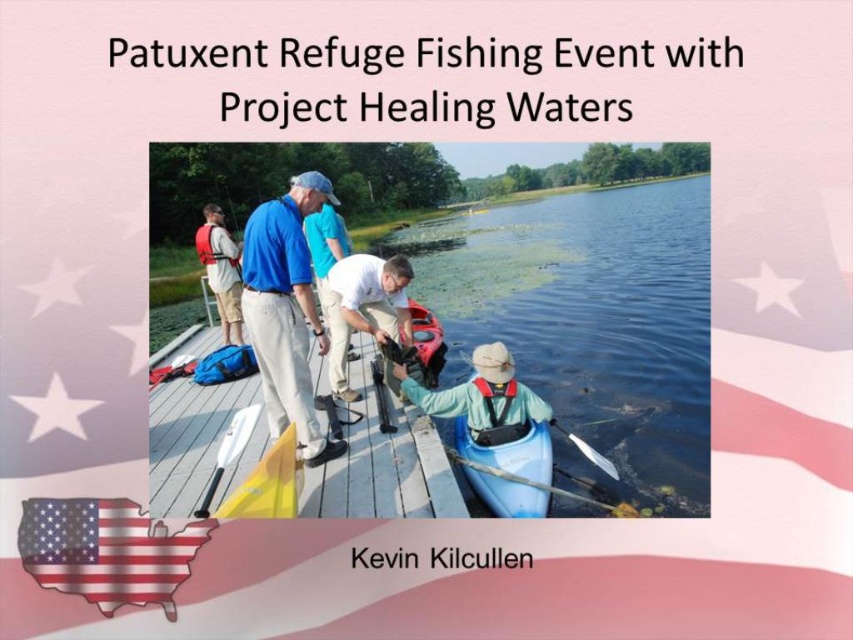
Question: Which point is closer to the camera?

Choices:
 (A) matte blue shirt at center
 (B) yellow matte kayak at lower left
 (C) white plastic paddle at center
 (D) white life vest at left

Answer: (B)

Question: From the image, what is the correct spatial relationship of tan fabric hat at lower right in relation to yellow matte kayak at lower left?

Choices:
 (A) right
 (B) left

Answer: (A)

Question: Among these objects, which one is farthest from the camera?

Choices:
 (A) white plastic paddle at center
 (B) matte blue shirt at center

Answer: (B)

Question: Is the position of white life vest at left less distant than that of white plastic paddle at lower center?

Choices:
 (A) yes
 (B) no

Answer: (B)

Question: Is blue plastic kayak at lower center in front of white plastic paddle at center?

Choices:
 (A) yes
 (B) no

Answer: (B)

Question: Which object is closer to the camera taking this photo?

Choices:
 (A) white life vest at left
 (B) american flag at lower left
 (C) white plastic paddle at lower center

Answer: (B)